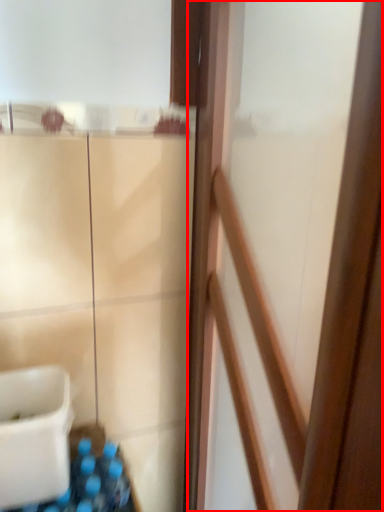
Question: Considering the relative positions of screen door (annotated by the red box) and sink in the image provided, where is screen door (annotated by the red box) located with respect to the staircase?

Choices:
 (A) left
 (B) right

Answer: (B)